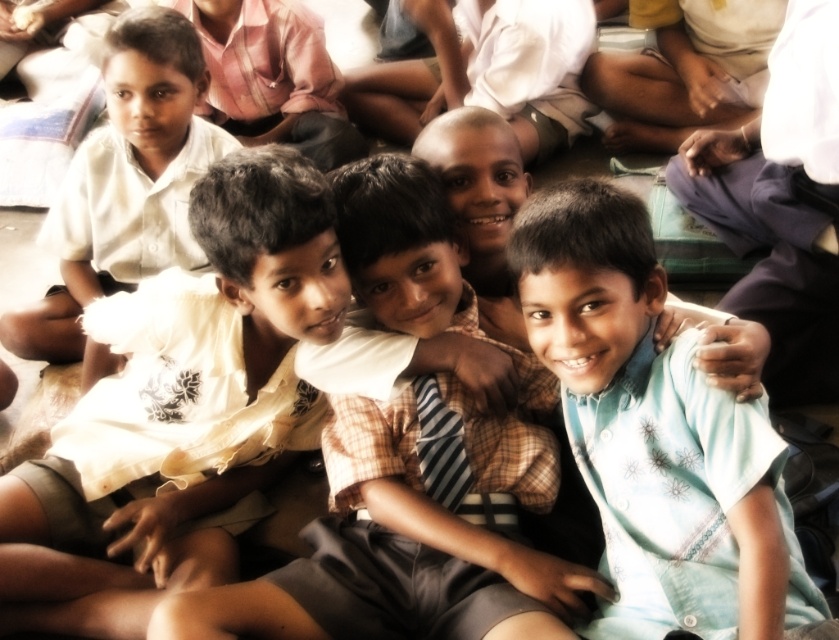
You are a photographer trying to capture a clear photo of the striped fabric tie at center and the white shirt at left. Which object is closer to the camera so that it won be obstructed by the other?

The white shirt at left is closer to the camera than the striped fabric tie at center, so the white shirt at left will not be obstructed by the striped fabric tie at center.

You are a tailor who needs to determine which item is bigger between the white shirt at left and the striped fabric tie at center. Which one should you choose to work on first if you prioritize larger items?

The white shirt at left has a larger size compared to the striped fabric tie at center, so you should choose to work on the white shirt at left first.

From the picture: Based on the coordinates provided, which object is located at the point (x=124, y=184) in the scene?

The point (x=124, y=184) corresponds to the white shirt at left.